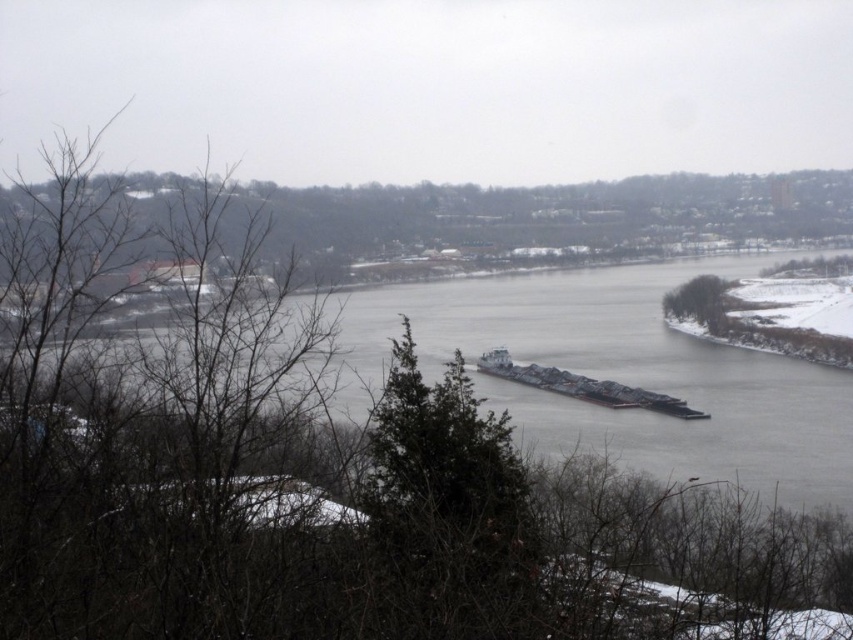
You are standing on the riverbank and see the dark gray metallic barge at center and the green leafy tree at right. Which object is closer to your left side?

The dark gray metallic barge at center is closer to your left side because it is positioned to the left of the green leafy tree at right.

You are standing on the riverbank and see the dark gray metallic barge at center. If you want to throw a small object to the barge, and your throwing distance is 50 feet, will you be able to reach it?

The dark gray metallic barge at center is 49.96 feet away from the viewer. Since your throwing distance is 50 feet, you can just barely reach it.

You are a delivery drone that needs to fly from the dark gray metallic barge at center to the green leafy tree at right. The minimum safe distance between your drone and any object is 1.5 meters. Can you safely make this flight without violating the safety distance?

The distance between the dark gray metallic barge at center and the green leafy tree at right is 1.59 meters. Since the minimum safe distance is 1.5 meters, the drone can safely fly between them as the distance is slightly more than required.